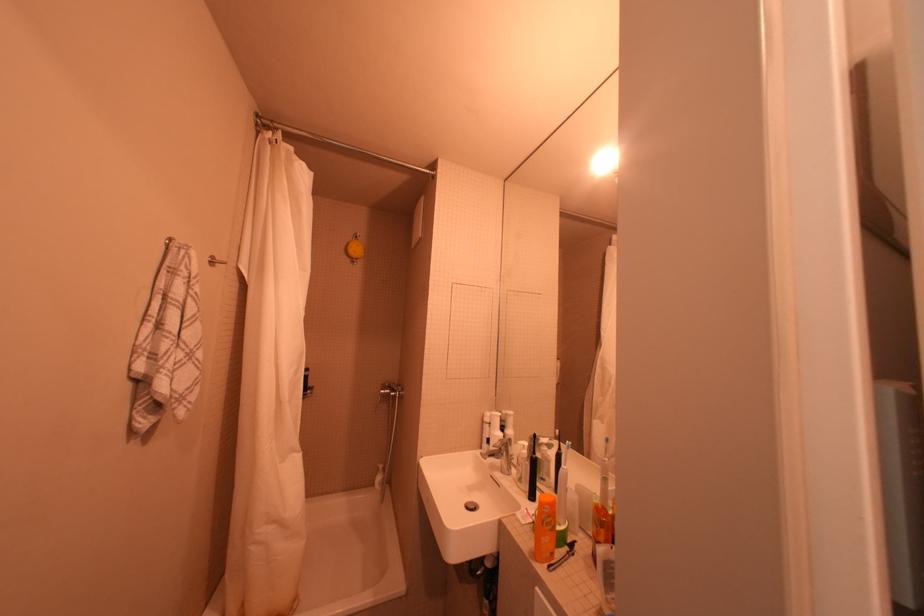
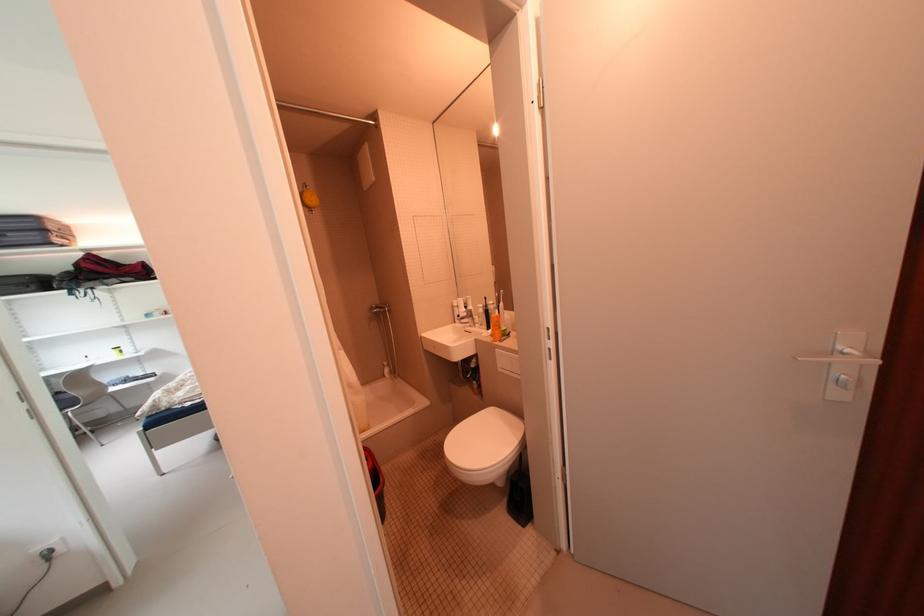
Where in the second image is the point corresponding to the point at 402,391 from the first image?

(390, 309)